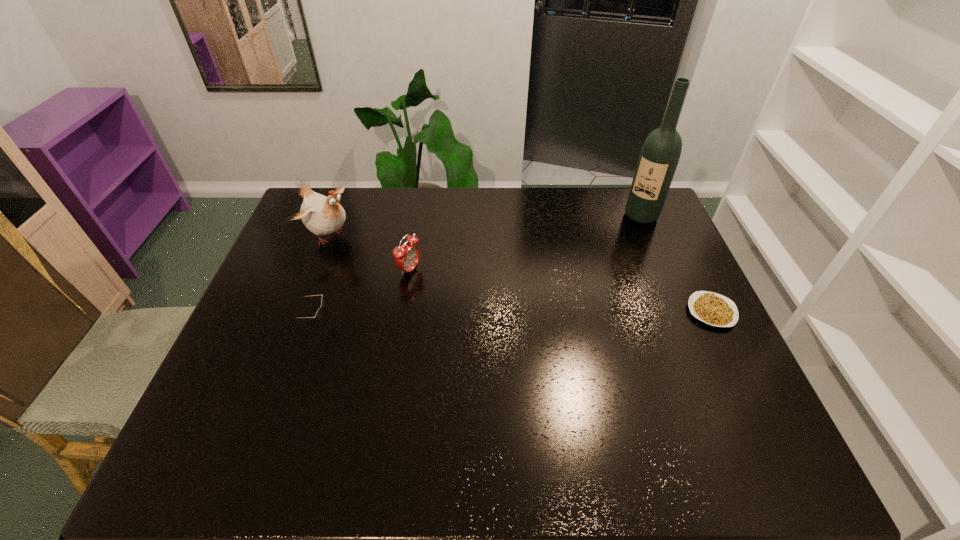
Where is `bird that is at the left edge`? The image size is (960, 540). bird that is at the left edge is located at coordinates (322, 215).

You are a GUI agent. You are given a task and a screenshot of the screen. Output one action in this format:
    pyautogui.click(x=<x>, y=<y>)
    Task: Click on the legume present at the right edge
    The image size is (960, 540).
    Given the screenshot: What is the action you would take?
    pyautogui.click(x=717, y=310)

This screenshot has width=960, height=540. In order to click on wine bottle present at the right edge in this screenshot , I will do `click(661, 150)`.

At what (x,y) coordinates should I click in order to perform the action: click on object positioned at the far left corner. Please return your answer as a coordinate pair (x, y). This screenshot has height=540, width=960. Looking at the image, I should click on (322, 215).

Where is `object that is at the far right corner`? object that is at the far right corner is located at coordinates (661, 150).

Image resolution: width=960 pixels, height=540 pixels. In the image, there is a desktop. What are the coordinates of `free space at the far edge` in the screenshot? It's located at (551, 211).

In the image, there is a desktop. In order to click on vacant space at the left edge in this screenshot , I will do `click(312, 301)`.

In the image, there is a desktop. Where is `vacant space at the right edge`? vacant space at the right edge is located at coordinates (653, 299).

Where is `free space that is in between the wine bottle and the sunglasses`? This screenshot has height=540, width=960. free space that is in between the wine bottle and the sunglasses is located at coordinates click(477, 269).

At what (x,y) coordinates should I click in order to perform the action: click on empty location between the sunglasses and the bird. Please return your answer as a coordinate pair (x, y). The image size is (960, 540). Looking at the image, I should click on (322, 279).